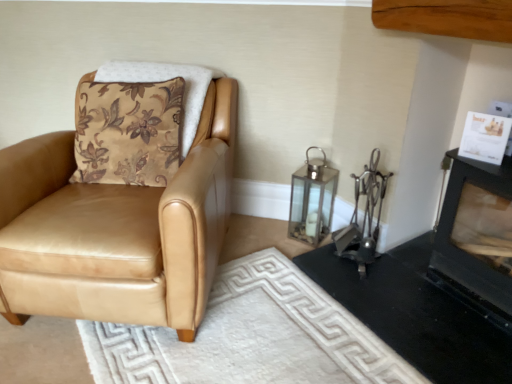
In order to click on free region under white textured rug at lower center (from a real-world perspective) in this screenshot , I will do `click(264, 336)`.